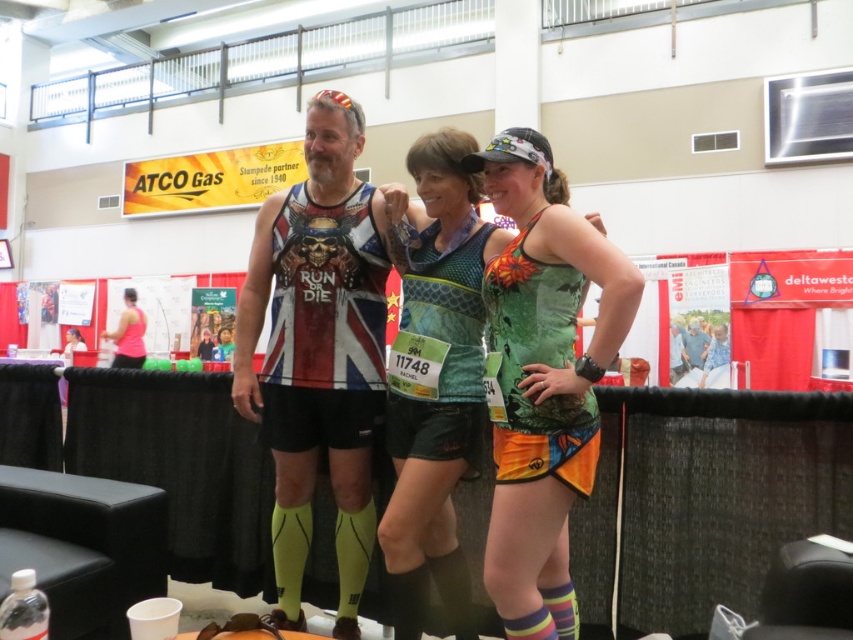
Locate an element on the screen. The width and height of the screenshot is (853, 640). matte jersey at center is located at coordinates (318, 353).

Is matte jersey at center bigger than matte black tank top at center?

Indeed, matte jersey at center has a larger size compared to matte black tank top at center.

At what (x,y) coordinates should I click in order to perform the action: click on matte jersey at center. Please return your answer as a coordinate pair (x, y). Looking at the image, I should click on 318,353.

Can you confirm if matte jersey at center is taller than green camouflage tank top at center?

Correct, matte jersey at center is much taller as green camouflage tank top at center.

Consider the image. Does matte jersey at center have a lesser height compared to green camouflage tank top at center?

In fact, matte jersey at center may be taller than green camouflage tank top at center.

Measure the distance between matte jersey at center and camera.

A distance of 2.03 meters exists between matte jersey at center and camera.

Locate an element on the screen. matte jersey at center is located at coordinates (318, 353).

Can you confirm if matte jersey at center is smaller than pink fabric tank top at left?

Correct, matte jersey at center occupies less space than pink fabric tank top at left.

Between matte jersey at center and pink fabric tank top at left, which one is positioned higher?

Positioned higher is matte jersey at center.

The height and width of the screenshot is (640, 853). Find the location of `matte jersey at center`. matte jersey at center is located at coordinates (318, 353).

Locate an element on the screen. Image resolution: width=853 pixels, height=640 pixels. matte jersey at center is located at coordinates (318, 353).